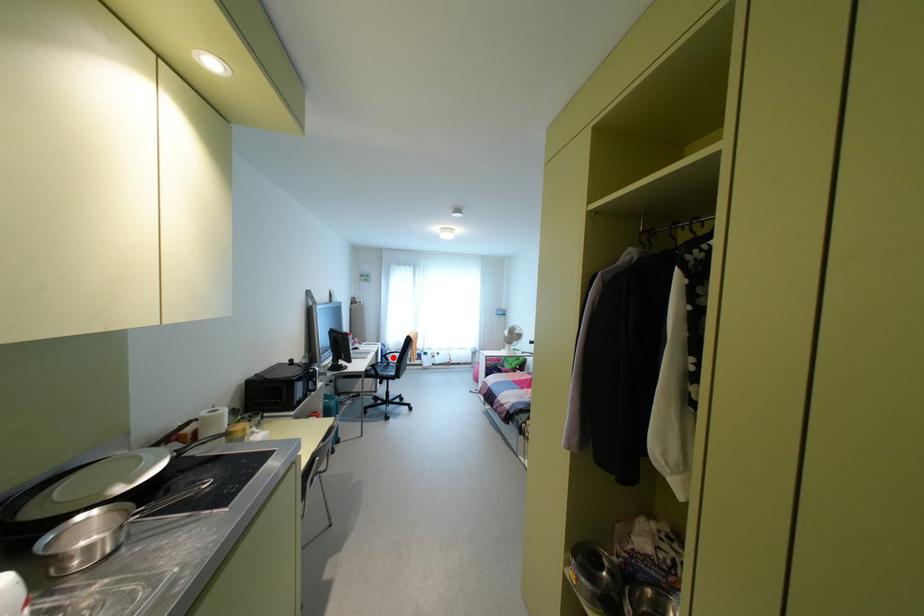
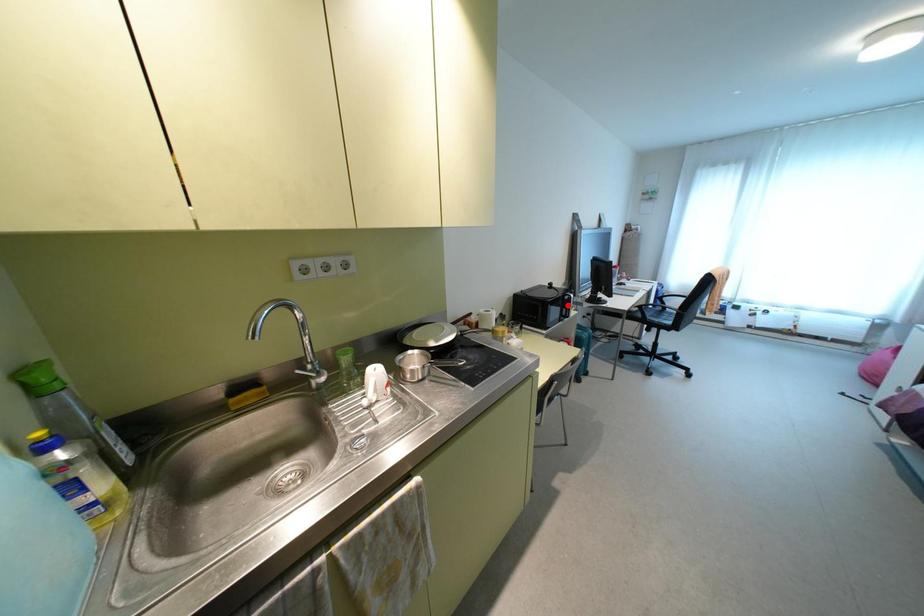
I am providing you with two images of the same scene from different viewpoints. A red point is marked on the first image and another point is marked on the second image. Does the point marked in image1 correspond to the same location as the one in image2?

No